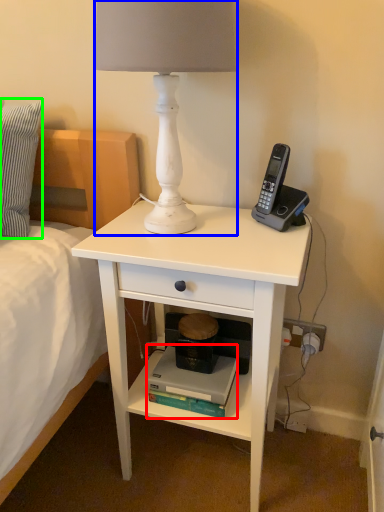
Question: Based on their relative distances, which object is nearer to book (highlighted by a red box)? Choose from lamp (highlighted by a blue box) and pillow (highlighted by a green box).

Choices:
 (A) lamp
 (B) pillow

Answer: (A)